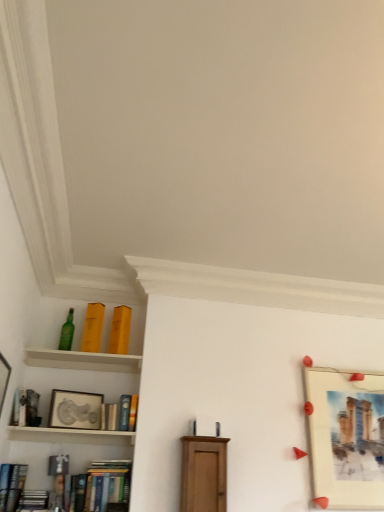
The image size is (384, 512). Find the location of `free location above matte wood cabinet at center (from a real-world perspective)`. free location above matte wood cabinet at center (from a real-world perspective) is located at coordinates (197, 436).